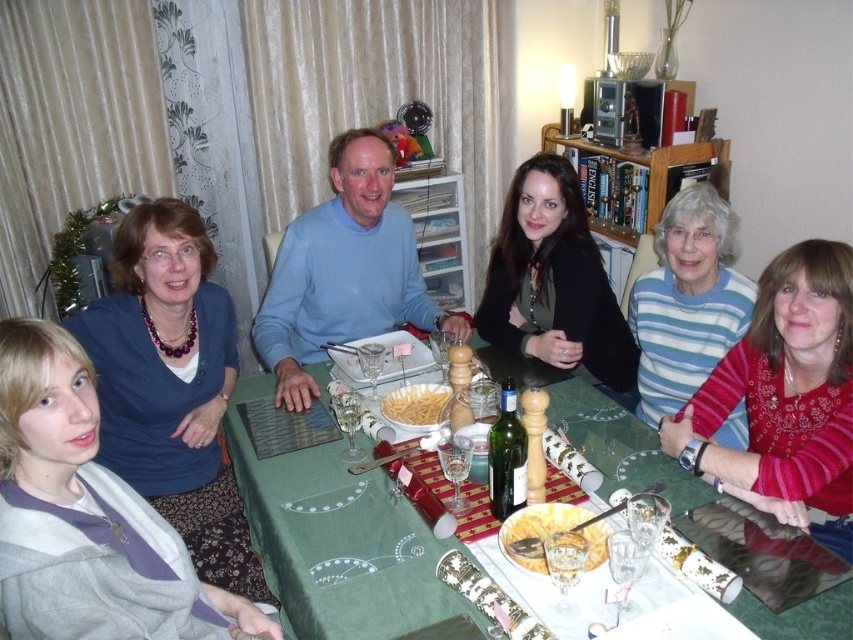
You are a server who needs to deliver a tray of appetizers to the dining table. The tray is 3 feet wide. Can you safely place the tray between the green fabric table at center and the striped sweater at center without moving either object?

The distance between the green fabric table at center and the striped sweater at center is 3.54 feet, which is wider than the tray of 3 feet. Therefore, the tray can be safely placed between them without moving either object.

You are sitting at the dining table and want to place a decorative item on the green fabric table at center. However, you notice the striped sweater at center is in the way. Which object should you move to access the table?

The striped sweater at center is behind the green fabric table at center, so you should move the striped sweater at center to access the table.

You are a guest at this dinner and want to reach for the yellow pasta at center without disturbing the matte blue sweater at upper left. Can you do this easily?

The matte blue sweater at upper left is closer to the viewer than the yellow pasta at center, so reaching for the yellow pasta at center might require moving the matte blue sweater at upper left first, making it difficult to do so without disturbing it.